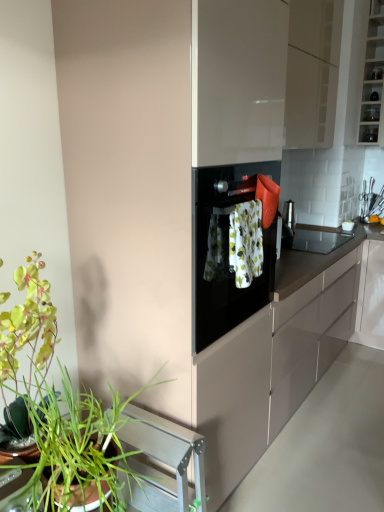
Question: Does floral fabric towel at center have a greater height compared to green leafy plant at lower left?

Choices:
 (A) no
 (B) yes

Answer: (A)

Question: From the image's perspective, would you say floral fabric towel at center is positioned over green leafy plant at lower left?

Choices:
 (A) yes
 (B) no

Answer: (A)

Question: Is floral fabric towel at center not within green leafy plant at lower left?

Choices:
 (A) yes
 (B) no

Answer: (A)

Question: Does floral fabric towel at center have a smaller size compared to green leafy plant at lower left?

Choices:
 (A) no
 (B) yes

Answer: (B)

Question: Considering the relative positions of floral fabric towel at center and green leafy plant at lower left in the image provided, is floral fabric towel at center to the right of green leafy plant at lower left from the viewer's perspective?

Choices:
 (A) no
 (B) yes

Answer: (B)

Question: Is green leafy plant at lower left bigger or smaller than glossy beige cabinet at upper center, which appears as the second cabinetry when viewed from the right?

Choices:
 (A) big
 (B) small

Answer: (B)

Question: In terms of width, does green leafy plant at lower left look wider or thinner when compared to glossy beige cabinet at upper center, which appears as the second cabinetry when viewed from the right?

Choices:
 (A) thin
 (B) wide

Answer: (B)

Question: Based on their positions, is green leafy plant at lower left located to the left or right of glossy beige cabinet at upper center, which is counted as the 1th cabinetry, starting from the left?

Choices:
 (A) left
 (B) right

Answer: (A)

Question: Choose the correct answer: Is green leafy plant at lower left inside glossy beige cabinet at upper center, which appears as the second cabinetry when viewed from the right, or outside it?

Choices:
 (A) inside
 (B) outside

Answer: (B)

Question: In terms of width, does glossy beige cabinet at upper center, which is counted as the 1th cabinetry, starting from the left, look wider or thinner when compared to black matte countertop at center?

Choices:
 (A) thin
 (B) wide

Answer: (A)

Question: From their relative heights in the image, would you say glossy beige cabinet at upper center, which appears as the second cabinetry when viewed from the right, is taller or shorter than black matte countertop at center?

Choices:
 (A) short
 (B) tall

Answer: (B)

Question: From the image's perspective, relative to black matte countertop at center, is glossy beige cabinet at upper center, which appears as the second cabinetry when viewed from the right, above or below?

Choices:
 (A) below
 (B) above

Answer: (B)

Question: From a real-world perspective, is glossy beige cabinet at upper center, which is counted as the 1th cabinetry, starting from the left, above or below black matte countertop at center?

Choices:
 (A) below
 (B) above

Answer: (B)

Question: From a real-world perspective, is floral fabric towel at center physically located above or below black matte countertop at center?

Choices:
 (A) above
 (B) below

Answer: (A)

Question: Do you think floral fabric towel at center is within black matte countertop at center, or outside of it?

Choices:
 (A) inside
 (B) outside

Answer: (B)